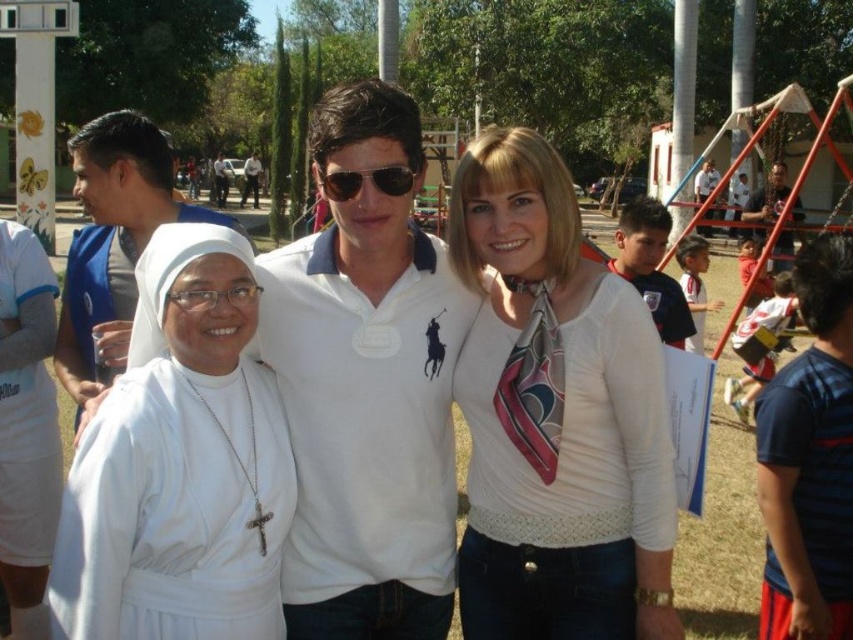
You are a photographer trying to capture a clear shot of both the white silk blouse at center and the white cotton shirt at center. Since you can only focus on one subject at a time, which one should you focus on to ensure the other remains somewhat in the background?

You should focus on the white silk blouse at center because it is in front of the white cotton shirt at center, so focusing on it will keep the white cotton shirt at center more in the background.

You are standing at the center of the park and see the white cloth at left and the white cotton shirt at right. If you want to reach both items, which one should you walk towards first to minimize the total distance traveled?

To minimize the total distance traveled, you should walk towards the white cloth at left first since it is closer to you than the white cotton shirt at right, which is farther away.

You are organizing a photo shoot and need to arrange the white silk blouse at center and the striped cotton shirt at right side by side. Based on their widths, which one should be placed on the left to avoid overcrowding the frame?

The white silk blouse at center might be wider than the striped cotton shirt at right, so placing the white silk blouse at center on the left would help prevent overcrowding as it may take up more space.